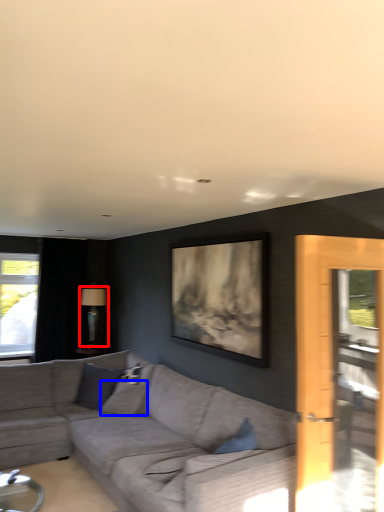
Question: Which object appears farthest to the camera in this image, lamp (highlighted by a red box) or pillow (highlighted by a blue box)?

Choices:
 (A) lamp
 (B) pillow

Answer: (A)